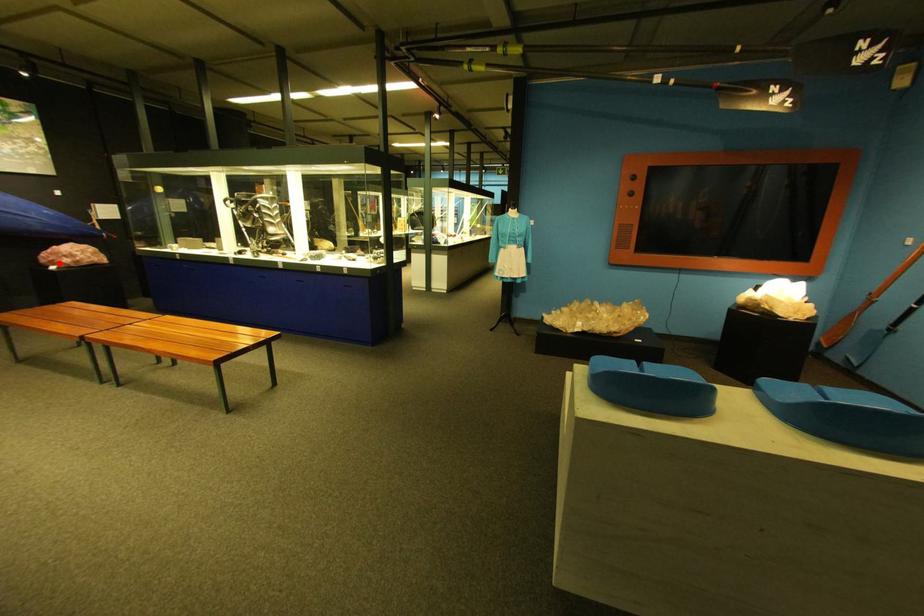
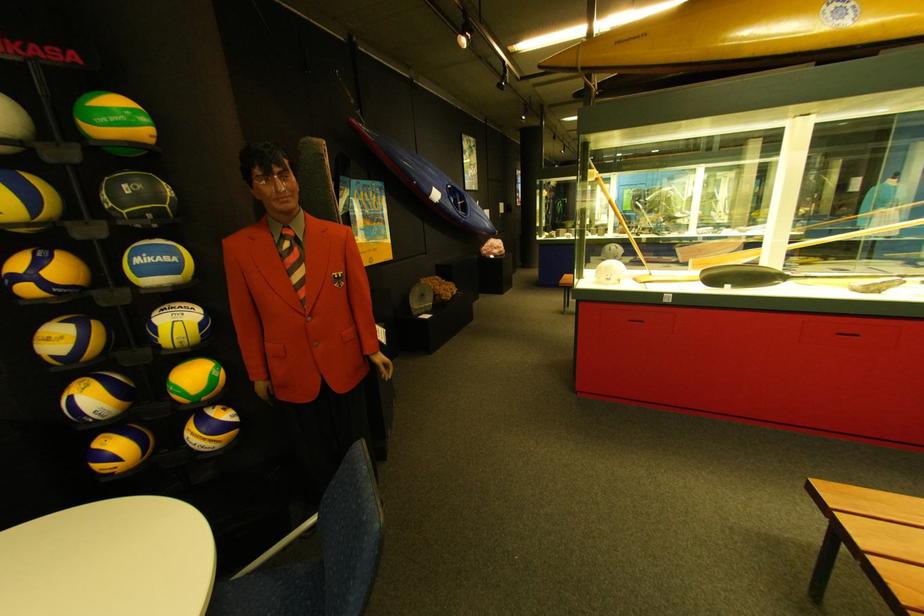
Locate, in the second image, the point that corresponds to the highlighted location in the first image.

(500, 254)